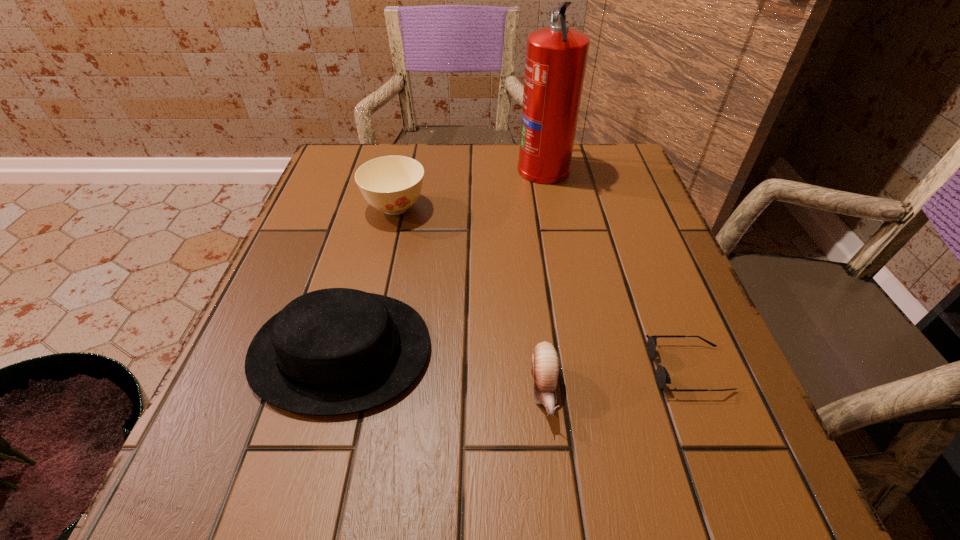
At what (x,y) coordinates should I click in order to perform the action: click on object that is at the right edge. Please return your answer as a coordinate pair (x, y). Looking at the image, I should click on (662, 376).

At what (x,y) coordinates should I click in order to perform the action: click on object located in the far left corner section of the desktop. Please return your answer as a coordinate pair (x, y). This screenshot has width=960, height=540. Looking at the image, I should click on (392, 184).

Where is `vacant region at the far edge of the desktop`? vacant region at the far edge of the desktop is located at coordinates (504, 163).

In the image, there is a desktop. Where is `free space at the near edge`? free space at the near edge is located at coordinates (644, 484).

At what (x,y) coordinates should I click in order to perform the action: click on vacant area at the left edge. Please return your answer as a coordinate pair (x, y). This screenshot has height=540, width=960. Looking at the image, I should click on (242, 380).

Where is `free space at the right edge of the desktop`? The width and height of the screenshot is (960, 540). free space at the right edge of the desktop is located at coordinates (677, 258).

Identify the location of blank area at the far left corner. (352, 193).

At what (x,y) coordinates should I click in order to perform the action: click on empty space that is in between the sugar bowl and the second shortest object. Please return your answer as a coordinate pair (x, y). Looking at the image, I should click on (469, 299).

Locate an element on the screen. free area in between the escargot and the fedora is located at coordinates (443, 370).

Locate an element on the screen. vacant space that is in between the fedora and the fire extinguisher is located at coordinates (443, 259).